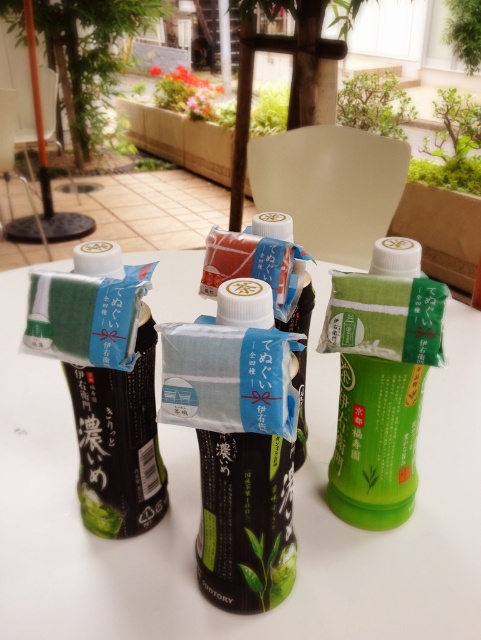
Based on the photo, you are sitting at the table and want to grab a drink. There are two bottles in front of you, the green matte plastic bottles at center and the matte black bottle at center. Which one is closer to you?

The green matte plastic bottles at center is closer to you because it is further to the viewer than the matte black bottle at center.

You are standing at the edge of the table where the beverages are placed. You need to reach for an item located at either point. Which point is closer to you, point (50, 611) or point (239, 541)?

Point (50, 611) is closer to you because it is further to the viewer than point (239, 541).